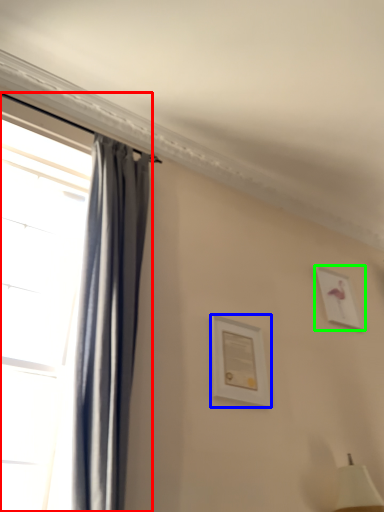
Question: Considering the real-world distances, which object is farthest from window (highlighted by a red box)? picture frame (highlighted by a blue box) or picture frame (highlighted by a green box)?

Choices:
 (A) picture frame
 (B) picture frame

Answer: (B)